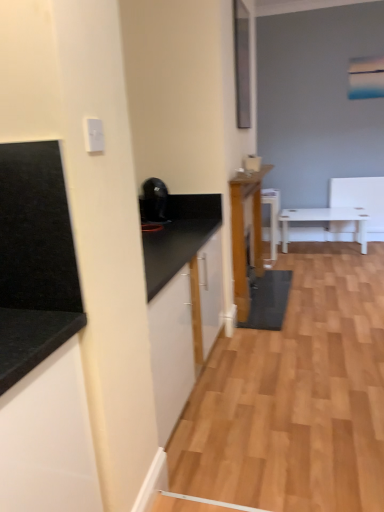
The image size is (384, 512). What are the coordinates of `wooden cabinet at center, which is the first cabinetry from back to front` in the screenshot? It's located at (245, 234).

What is the approximate width of black granite countertop at left, which appears as the second countertop when viewed from the front?

24.74 inches.

The width and height of the screenshot is (384, 512). What do you see at coordinates (179, 236) in the screenshot? I see `black granite countertop at left, which appears as the first countertop when viewed from the back` at bounding box center [179, 236].

You are a GUI agent. You are given a task and a screenshot of the screen. Output one action in this format:
    pyautogui.click(x=<x>, y=<y>)
    Task: Click on the wooden cabinet at center, placed as the 2th cabinetry when sorted from front to back
    The height and width of the screenshot is (512, 384).
    Given the screenshot: What is the action you would take?
    pyautogui.click(x=245, y=234)

Which of these two, black glossy coffee maker at upper center or black granite countertop at left, the first countertop in the front-to-back sequence, stands taller?

Standing taller between the two is black granite countertop at left, the first countertop in the front-to-back sequence.

Is black glossy coffee maker at upper center situated inside black granite countertop at left, the first countertop in the front-to-back sequence, or outside?

black glossy coffee maker at upper center is outside black granite countertop at left, the first countertop in the front-to-back sequence.

Which is more distant, (153, 177) or (82, 322)?

The point (153, 177) is behind.

Can you confirm if black glossy coffee maker at upper center is positioned to the left of black granite countertop at left, placed as the second countertop when sorted from back to front?

No, black glossy coffee maker at upper center is not to the left of black granite countertop at left, placed as the second countertop when sorted from back to front.

How distant is black granite countertop at left, the first countertop in the front-to-back sequence, from black glossy coffee maker at upper center?

They are 1.86 meters apart.

Can we say black granite countertop at left, the first countertop in the front-to-back sequence, lies outside black glossy coffee maker at upper center?

That's correct, black granite countertop at left, the first countertop in the front-to-back sequence, is outside of black glossy coffee maker at upper center.

Is black granite countertop at left, placed as the second countertop when sorted from back to front, with black glossy coffee maker at upper center?

No, black granite countertop at left, placed as the second countertop when sorted from back to front, is not beside black glossy coffee maker at upper center.

From a real-world perspective, which is physically below, black granite countertop at left, which appears as the first countertop when viewed from the back, or black granite countertop at left, which is the 1th cabinetry in left-to-right order?

In real-world perspective, black granite countertop at left, which appears as the first countertop when viewed from the back, is lower.

From the image's perspective, would you say black granite countertop at left, which appears as the second countertop when viewed from the front, is shown under black granite countertop at left, which ranks as the first cabinetry in front-to-back order?

No.

Considering the relative sizes of black granite countertop at left, which appears as the first countertop when viewed from the back, and black granite countertop at left, which is the second cabinetry in right-to-left order, in the image provided, is black granite countertop at left, which appears as the first countertop when viewed from the back, wider than black granite countertop at left, which is the second cabinetry in right-to-left order,?

Correct, the width of black granite countertop at left, which appears as the first countertop when viewed from the back, exceeds that of black granite countertop at left, which is the second cabinetry in right-to-left order.

Is black granite countertop at left, which appears as the second countertop when viewed from the front, not within black granite countertop at left, which ranks as the first cabinetry in front-to-back order?

Yes.

From the picture: Which of these two, black granite countertop at left, which is the 1th cabinetry in left-to-right order, or black glossy coffee maker at upper center, is thinner?

Thinner between the two is black glossy coffee maker at upper center.

Does point (77, 469) come farther from viewer compared to point (141, 214)?

No, it is in front of (141, 214).

Considering their positions, is black granite countertop at left, which is the 1th cabinetry in left-to-right order, located in front of or behind black glossy coffee maker at upper center?

In the image, black granite countertop at left, which is the 1th cabinetry in left-to-right order, appears in front of black glossy coffee maker at upper center.

From a real-world perspective, is black granite countertop at left, which ranks as the first cabinetry in front-to-back order, positioned above or below black glossy coffee maker at upper center?

black granite countertop at left, which ranks as the first cabinetry in front-to-back order, is situated lower than black glossy coffee maker at upper center in the real world.

From the image's perspective, would you say wooden cabinet at center, acting as the second cabinetry starting from the left, is positioned over black glossy coffee maker at upper center?

No, from the image's perspective, wooden cabinet at center, acting as the second cabinetry starting from the left, is not on top of black glossy coffee maker at upper center.

Based on their sizes in the image, would you say wooden cabinet at center, arranged as the 1th cabinetry when viewed from the right, is bigger or smaller than black glossy coffee maker at upper center?

Considering their sizes, wooden cabinet at center, arranged as the 1th cabinetry when viewed from the right, takes up more space than black glossy coffee maker at upper center.

Is wooden cabinet at center, placed as the 2th cabinetry when sorted from front to back, inside or outside of black glossy coffee maker at upper center?

wooden cabinet at center, placed as the 2th cabinetry when sorted from front to back, is not inside black glossy coffee maker at upper center, it's outside.

Considering the positions of point (237, 181) and point (149, 179), is point (237, 181) closer or farther from the camera than point (149, 179)?

Point (237, 181) is farther from the camera than point (149, 179).

Which is more to the left, black glossy coffee maker at upper center or wooden cabinet at center, placed as the 2th cabinetry when sorted from front to back?

black glossy coffee maker at upper center is more to the left.

Considering the sizes of objects black glossy coffee maker at upper center and wooden cabinet at center, placed as the 2th cabinetry when sorted from front to back, in the image provided, who is taller, black glossy coffee maker at upper center or wooden cabinet at center, placed as the 2th cabinetry when sorted from front to back,?

wooden cabinet at center, placed as the 2th cabinetry when sorted from front to back.

Which object is closer to the camera, black glossy coffee maker at upper center or wooden cabinet at center, arranged as the 1th cabinetry when viewed from the right?

black glossy coffee maker at upper center is closer to the camera.

Considering the relative sizes of black granite countertop at left, which is the 1th cabinetry in left-to-right order, and wooden cabinet at center, acting as the second cabinetry starting from the left, in the image provided, is black granite countertop at left, which is the 1th cabinetry in left-to-right order, taller than wooden cabinet at center, acting as the second cabinetry starting from the left,?

In fact, black granite countertop at left, which is the 1th cabinetry in left-to-right order, may be shorter than wooden cabinet at center, acting as the second cabinetry starting from the left.

Which is more to the right, black granite countertop at left, which is counted as the 2th cabinetry, starting from the back, or wooden cabinet at center, arranged as the 1th cabinetry when viewed from the right?

wooden cabinet at center, arranged as the 1th cabinetry when viewed from the right, is more to the right.

Is black granite countertop at left, which ranks as the first cabinetry in front-to-back order, located outside wooden cabinet at center, placed as the 2th cabinetry when sorted from front to back?

Absolutely, black granite countertop at left, which ranks as the first cabinetry in front-to-back order, is external to wooden cabinet at center, placed as the 2th cabinetry when sorted from front to back.

Between black granite countertop at left, which is the 1th cabinetry in left-to-right order, and wooden cabinet at center, placed as the 2th cabinetry when sorted from front to back, which one has larger width?

black granite countertop at left, which is the 1th cabinetry in left-to-right order.

You are a GUI agent. You are given a task and a screenshot of the screen. Output one action in this format:
    pyautogui.click(x=<x>, y=<y>)
    Task: Click on the appliance below the black granite countertop at left, the first countertop in the front-to-back sequence (from a real-world perspective)
    This screenshot has width=384, height=512.
    Given the screenshot: What is the action you would take?
    pyautogui.click(x=154, y=200)

Where is `countertop above the black glossy coffee maker at upper center (from a real-world perspective)`? The image size is (384, 512). countertop above the black glossy coffee maker at upper center (from a real-world perspective) is located at coordinates (35, 259).

When comparing their distances from wooden cabinet at center, which is the first cabinetry from back to front, does black granite countertop at left, which ranks as the first cabinetry in front-to-back order, or black granite countertop at left, which appears as the first countertop when viewed from the back, seem further?

black granite countertop at left, which ranks as the first cabinetry in front-to-back order, is positioned further to the anchor wooden cabinet at center, which is the first cabinetry from back to front.

Consider the image. Based on their spatial positions, is black granite countertop at left, which appears as the second countertop when viewed from the front, or black glossy coffee maker at upper center closer to black granite countertop at left, which ranks as the first cabinetry in front-to-back order?

Among the two, black granite countertop at left, which appears as the second countertop when viewed from the front, is located nearer to black granite countertop at left, which ranks as the first cabinetry in front-to-back order.

Considering their positions, is black granite countertop at left, which appears as the second countertop when viewed from the front, positioned further to black glossy coffee maker at upper center than black granite countertop at left, which is the second cabinetry in right-to-left order?

black granite countertop at left, which is the second cabinetry in right-to-left order, lies further to black glossy coffee maker at upper center than the other object.

Based on their spatial positions, is black glossy coffee maker at upper center or black granite countertop at left, placed as the second countertop when sorted from back to front, closer to wooden cabinet at center, acting as the second cabinetry starting from the left?

black glossy coffee maker at upper center is positioned closer to the anchor wooden cabinet at center, acting as the second cabinetry starting from the left.

From the picture: Considering their positions, is wooden cabinet at center, arranged as the 1th cabinetry when viewed from the right, positioned further to black granite countertop at left, which is the 1th cabinetry in left-to-right order, than black granite countertop at left, which appears as the first countertop when viewed from the back?

Based on the image, wooden cabinet at center, arranged as the 1th cabinetry when viewed from the right, appears to be further to black granite countertop at left, which is the 1th cabinetry in left-to-right order.

Looking at the image, which one is located further to black glossy coffee maker at upper center, black granite countertop at left, which is counted as the 2th cabinetry, starting from the back, or wooden cabinet at center, arranged as the 1th cabinetry when viewed from the right?

Among the two, black granite countertop at left, which is counted as the 2th cabinetry, starting from the back, is located further to black glossy coffee maker at upper center.

Looking at the image, which one is located further to black granite countertop at left, which ranks as the first cabinetry in front-to-back order, black granite countertop at left, the first countertop in the front-to-back sequence, or black glossy coffee maker at upper center?

black glossy coffee maker at upper center.

From the image, which object appears to be farther from wooden cabinet at center, acting as the second cabinetry starting from the left, black granite countertop at left, the first countertop in the front-to-back sequence, or black granite countertop at left, which appears as the second countertop when viewed from the front?

black granite countertop at left, the first countertop in the front-to-back sequence, is further to wooden cabinet at center, acting as the second cabinetry starting from the left.

Locate an element on the screen. The height and width of the screenshot is (512, 384). countertop between black granite countertop at left, which ranks as the first cabinetry in front-to-back order, and black granite countertop at left, which appears as the first countertop when viewed from the back, in the front-back direction is located at coordinates (35, 259).

Find the location of a particular element. Image resolution: width=384 pixels, height=512 pixels. appliance located between black granite countertop at left, which appears as the first countertop when viewed from the back, and wooden cabinet at center, which is the first cabinetry from back to front, in the depth direction is located at coordinates (154, 200).

Find the location of a particular element. The width and height of the screenshot is (384, 512). countertop positioned between black granite countertop at left, the first countertop in the front-to-back sequence, and black glossy coffee maker at upper center from near to far is located at coordinates (179, 236).

Where is `appliance between black granite countertop at left, the first countertop in the front-to-back sequence, and wooden cabinet at center, which is the first cabinetry from back to front, along the z-axis`? The image size is (384, 512). appliance between black granite countertop at left, the first countertop in the front-to-back sequence, and wooden cabinet at center, which is the first cabinetry from back to front, along the z-axis is located at coordinates click(x=154, y=200).